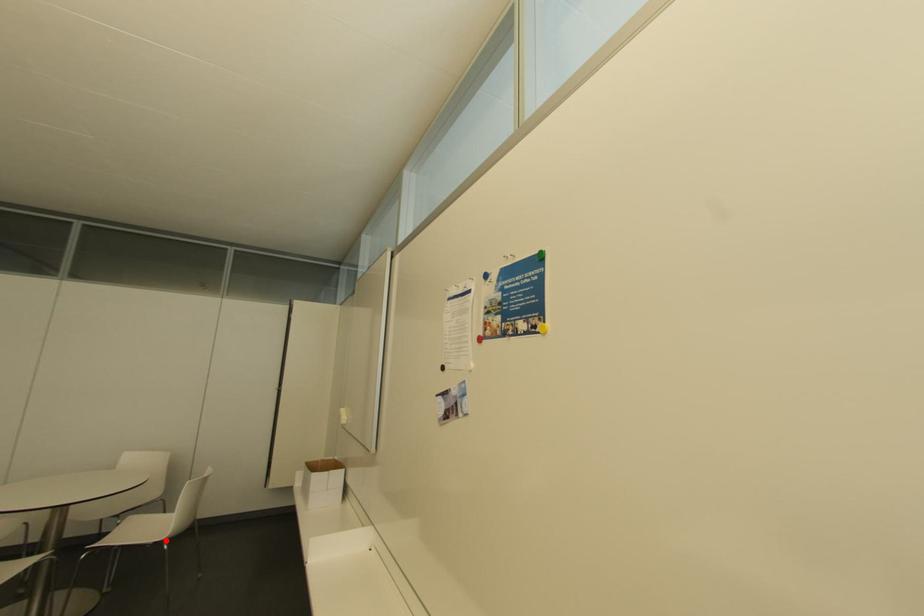
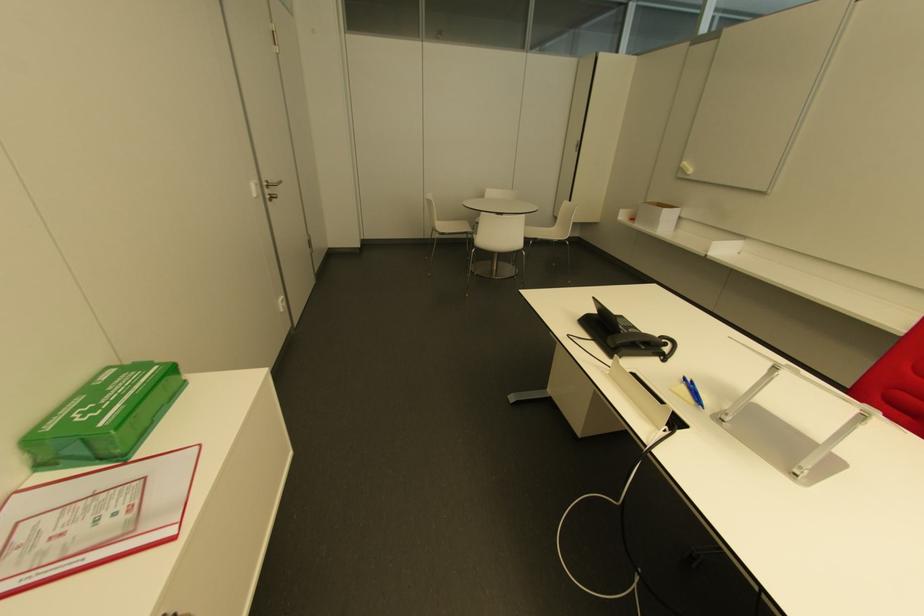
Question: I am providing you with two images of the same scene from different viewpoints. Image1 has a red point marked. In image2, the corresponding 3D location appears at what relative position? Reply with the corresponding letter.

Choices:
 (A) Closer
 (B) Farther

Answer: (A)